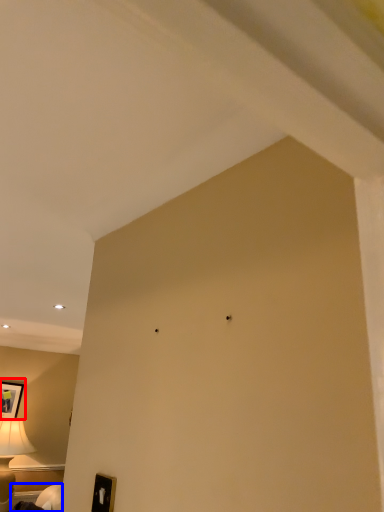
Question: Which of the following is the closest to the observer, picture frame (highlighted by a red box) or furniture (highlighted by a blue box)?

Choices:
 (A) picture frame
 (B) furniture

Answer: (B)